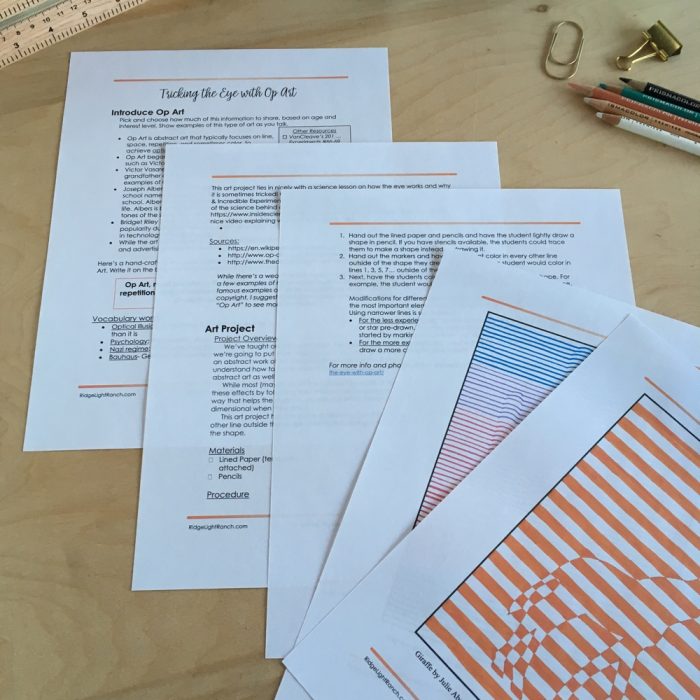
Locate an element on the screen. Image resolution: width=700 pixels, height=700 pixels. piece of paper is located at coordinates (553, 440), (447, 298), (382, 206), (211, 160), (314, 59).